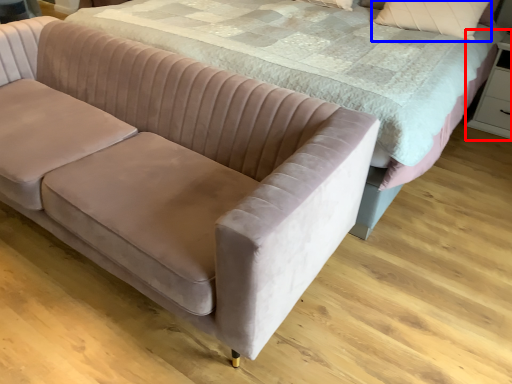
Question: Which of the following is the closest to the observer, dresser (highlighted by a red box) or pillow (highlighted by a blue box)?

Choices:
 (A) dresser
 (B) pillow

Answer: (B)